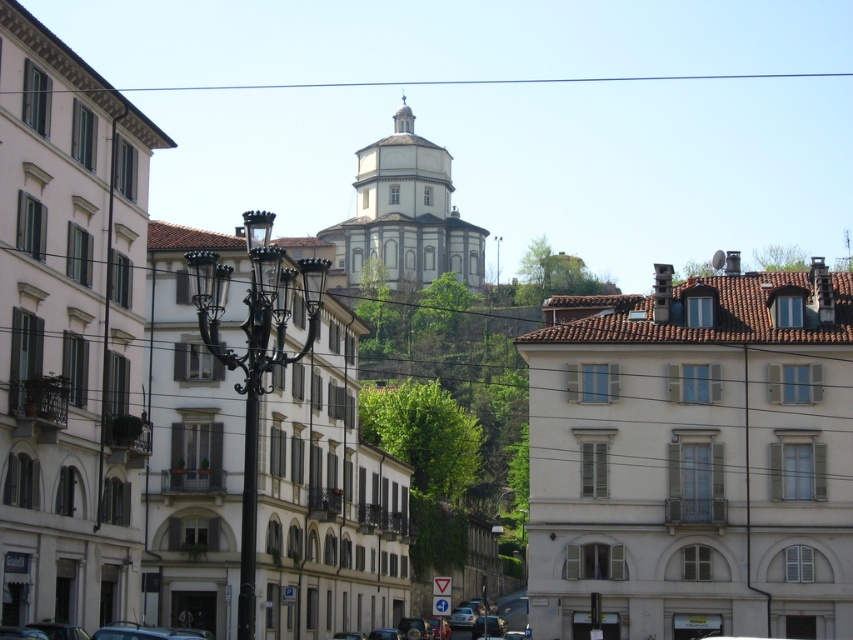
You are a tourist standing in front of the white stone church at center and the white smooth dome at center. Which structure is positioned higher in the image?

The white smooth dome at center is positioned higher than the white stone church at center because the description states that the white stone church at center is below the white smooth dome at center.

You are a tourist standing in the square and want to take a photo of the white tiled roof at upper center and the white stone church at center. Which one should you point your camera towards first to capture both in the frame?

The white tiled roof at upper center is below the white stone church at center, so you should point your camera towards the white stone church at center first to ensure both are in the frame.